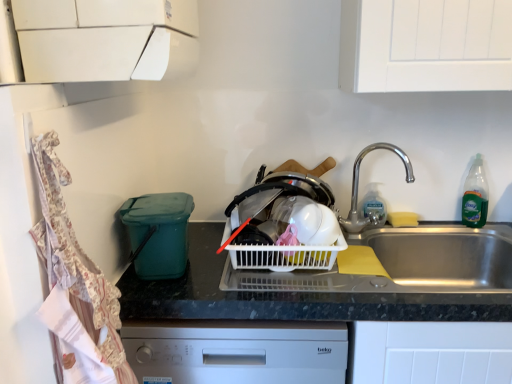
Question: Does teal plastic bin at left have a lesser width compared to white plastic basket at center?

Choices:
 (A) no
 (B) yes

Answer: (B)

Question: Can you confirm if teal plastic bin at left is positioned to the right of white plastic basket at center?

Choices:
 (A) yes
 (B) no

Answer: (B)

Question: Is teal plastic bin at left surrounding white plastic basket at center?

Choices:
 (A) no
 (B) yes

Answer: (A)

Question: Considering the relative sizes of teal plastic bin at left and white plastic basket at center in the image provided, is teal plastic bin at left shorter than white plastic basket at center?

Choices:
 (A) yes
 (B) no

Answer: (B)

Question: Is teal plastic bin at left to the left of white plastic basket at center from the viewer's perspective?

Choices:
 (A) no
 (B) yes

Answer: (B)

Question: Considering the relative sizes of teal plastic bin at left and white plastic basket at center in the image provided, is teal plastic bin at left taller than white plastic basket at center?

Choices:
 (A) no
 (B) yes

Answer: (B)

Question: Does clear plastic soap dispenser at sink right, marked as the 1th bottle in a left-to-right arrangement, appear on the left side of white plastic basket at center?

Choices:
 (A) no
 (B) yes

Answer: (A)

Question: From a real-world perspective, is clear plastic soap dispenser at sink right, marked as the 1th bottle in a left-to-right arrangement, over white plastic basket at center?

Choices:
 (A) yes
 (B) no

Answer: (A)

Question: Is clear plastic soap dispenser at sink right, positioned as the second bottle in right-to-left order, not near white plastic basket at center?

Choices:
 (A) yes
 (B) no

Answer: (B)

Question: From the image's perspective, is clear plastic soap dispenser at sink right, positioned as the second bottle in right-to-left order, beneath white plastic basket at center?

Choices:
 (A) yes
 (B) no

Answer: (B)

Question: Could you tell me if clear plastic soap dispenser at sink right, marked as the 1th bottle in a left-to-right arrangement, is turned towards white plastic basket at center?

Choices:
 (A) yes
 (B) no

Answer: (B)

Question: Is clear plastic soap dispenser at sink right, positioned as the second bottle in right-to-left order, not within white plastic basket at center?

Choices:
 (A) no
 (B) yes

Answer: (B)

Question: From a real-world perspective, is silver metallic faucet at upper right on top of teal plastic bin at left?

Choices:
 (A) yes
 (B) no

Answer: (A)